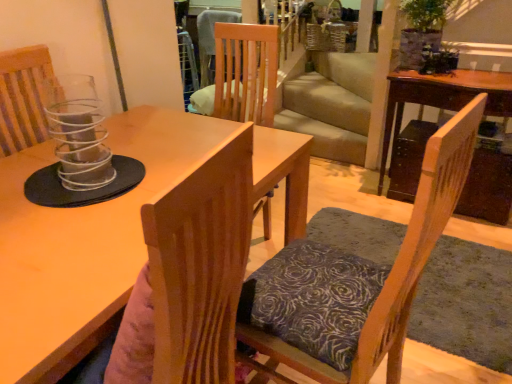
The width and height of the screenshot is (512, 384). I want to click on blank space situated above wooden table at right, which appears as the first table when viewed from the back (from a real-world perspective), so click(466, 74).